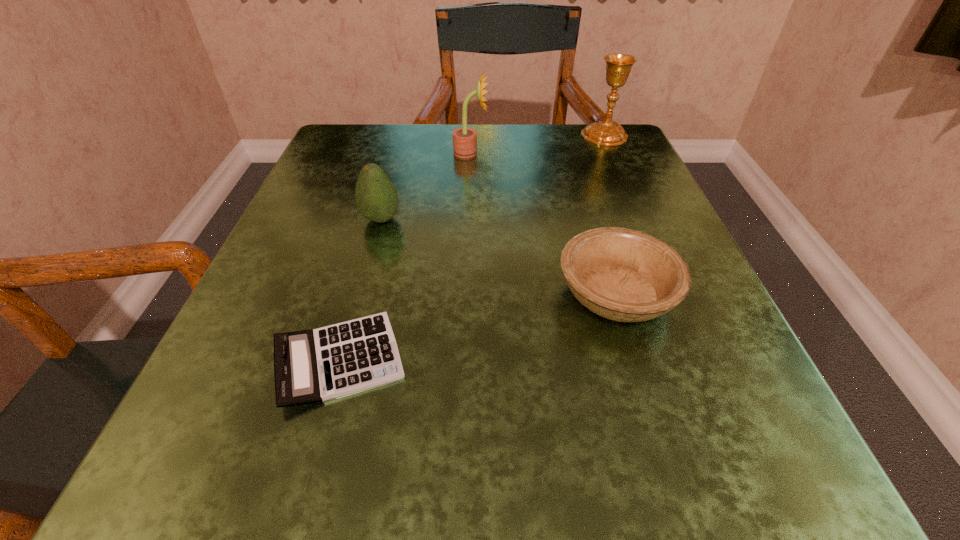
Where is `free region that satisfies the following two spatial constraints: 1. on the face of the sunflower; 2. on the front side of the calculator`? This screenshot has height=540, width=960. free region that satisfies the following two spatial constraints: 1. on the face of the sunflower; 2. on the front side of the calculator is located at coordinates (464, 360).

This screenshot has width=960, height=540. What are the coordinates of `free location that satisfies the following two spatial constraints: 1. on the front side of the fourth tallest object; 2. on the left side of the third tallest object` in the screenshot? It's located at (361, 294).